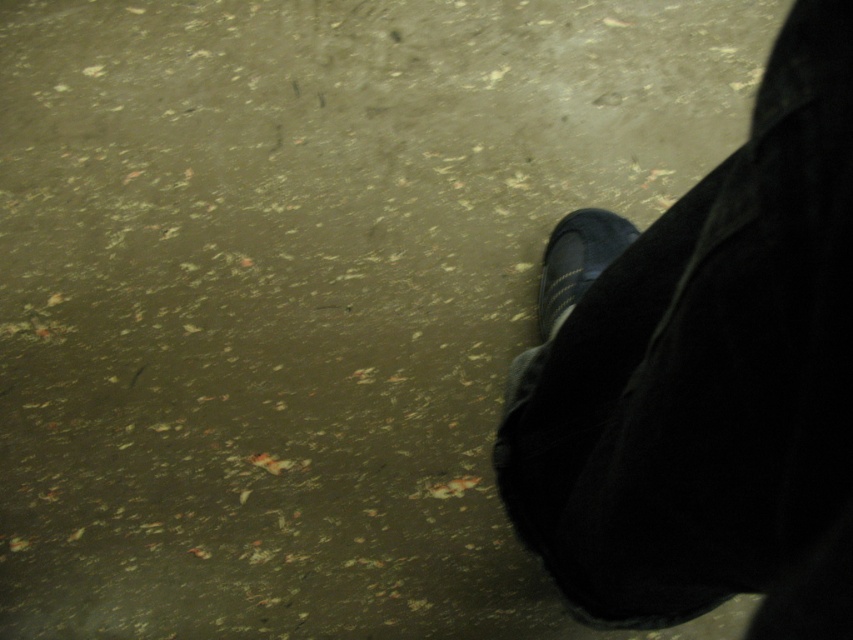
Question: Can you confirm if black fabric shoe at lower right is positioned to the right of matte black shoe at lower right?

Choices:
 (A) no
 (B) yes

Answer: (A)

Question: Which object is farther from the camera taking this photo?

Choices:
 (A) matte black shoe at lower right
 (B) black fabric shoe at lower right

Answer: (A)

Question: Which of the following is the farthest from the observer?

Choices:
 (A) black fabric shoe at lower right
 (B) matte black shoe at lower right

Answer: (B)

Question: Is the position of black fabric shoe at lower right less distant than that of matte black shoe at lower right?

Choices:
 (A) no
 (B) yes

Answer: (B)

Question: Is black fabric shoe at lower right behind matte black shoe at lower right?

Choices:
 (A) yes
 (B) no

Answer: (B)